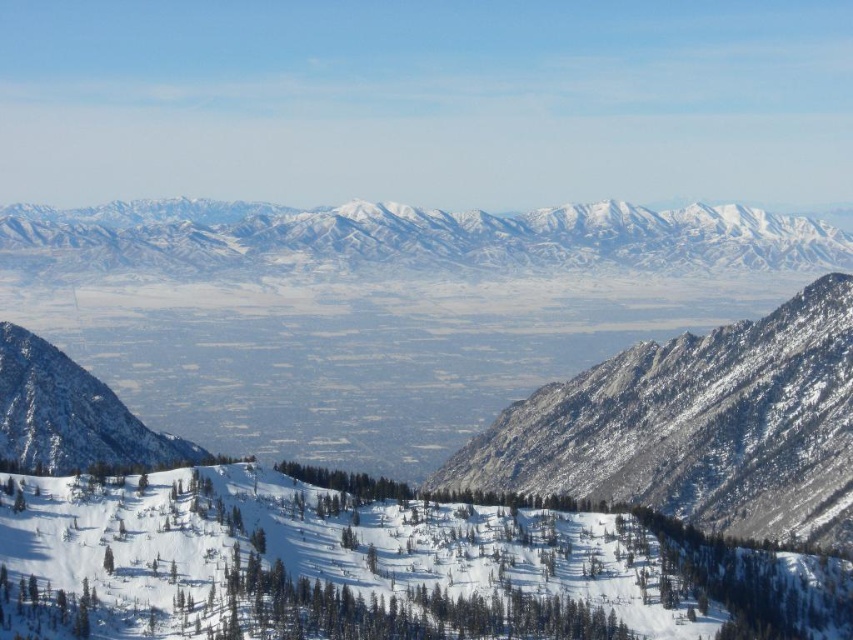
Question: Is snowy granite mountain at center-right closer to camera compared to snowy rocky mountain at left?

Choices:
 (A) no
 (B) yes

Answer: (A)

Question: Does snowy granite mountains at center have a greater width compared to snowy rocky mountain at left?

Choices:
 (A) yes
 (B) no

Answer: (A)

Question: Which is nearer to the snowy granite mountain at center-right?

Choices:
 (A) snowy rocky mountain at left
 (B) snowy granite mountains at center

Answer: (A)

Question: Is snowy granite mountain at center-right positioned before snowy rocky mountain at left?

Choices:
 (A) no
 (B) yes

Answer: (A)

Question: Which point is farther to the camera?

Choices:
 (A) (796, 264)
 (B) (42, 364)

Answer: (A)

Question: Which point appears farthest from the camera in this image?

Choices:
 (A) (706, 396)
 (B) (32, 406)
 (C) (715, 234)

Answer: (C)